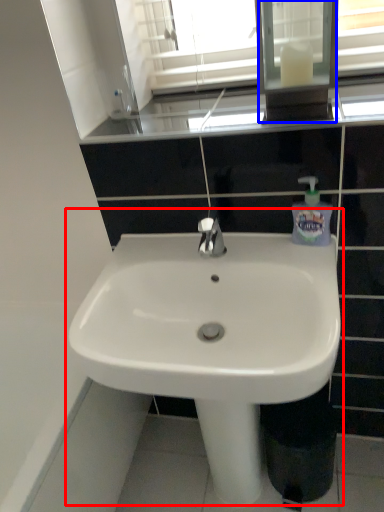
Question: Which of the following is the closest to the observer, sink (highlighted by a red box) or medicine cabinet (highlighted by a blue box)?

Choices:
 (A) sink
 (B) medicine cabinet

Answer: (A)